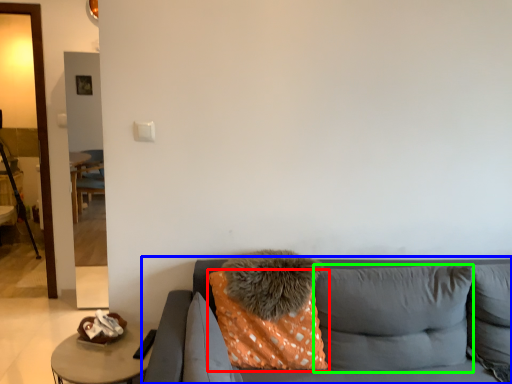
Question: Which object is positioned farthest from pillow (highlighted by a red box)? Select from studio couch (highlighted by a blue box) and pillow (highlighted by a green box).

Choices:
 (A) studio couch
 (B) pillow

Answer: (B)